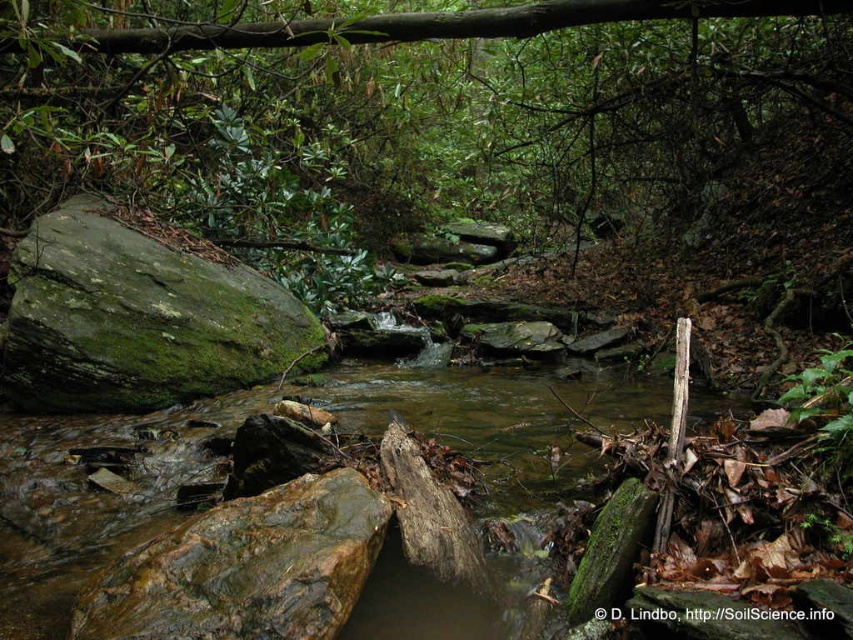
Does point (332, 400) lie behind point (45, 292)?

Yes, point (332, 400) is behind point (45, 292).

Which of these two, brown/mossy rock at center or green mossy rock at center-left, stands shorter?

brown/mossy rock at center is shorter.

Is point (448, 396) less distant than point (199, 324)?

No.

You are a GUI agent. You are given a task and a screenshot of the screen. Output one action in this format:
    pyautogui.click(x=<x>, y=<y>)
    Task: Click on the brown/mossy rock at center
    This screenshot has width=853, height=640.
    Given the screenshot: What is the action you would take?
    pyautogui.click(x=90, y=500)